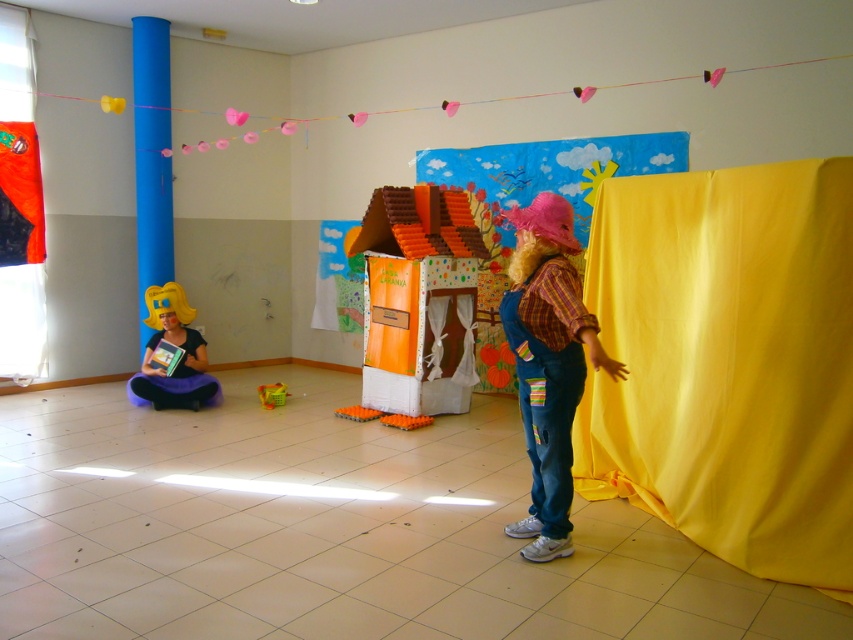
Is matte yellow wig at left wider than translucent plastic toy at center?

Yes, matte yellow wig at left is wider than translucent plastic toy at center.

Is point (195, 336) less distant than point (263, 404)?

No.

I want to click on matte yellow wig at left, so coord(178,358).

Which is more to the right, denim overalls at right or orange foam blocks at center?

denim overalls at right is more to the right.

Which is more to the left, denim overalls at right or orange foam blocks at center?

orange foam blocks at center

Between point (570, 300) and point (424, 420), which one is positioned behind?

The point (424, 420) is behind.

Find the location of a particular element. denim overalls at right is located at coordinates (548, 364).

Does yellow fabric at right have a greater height compared to orange fabric curtain at left?

Incorrect, yellow fabric at right's height is not larger of orange fabric curtain at left's.

Can you confirm if yellow fabric at right is positioned above orange fabric curtain at left?

Yes.

Which is behind, point (631, 6) or point (0, 148)?

The point (0, 148) is more distant.

You are a GUI agent. You are given a task and a screenshot of the screen. Output one action in this format:
    pyautogui.click(x=<x>, y=<y>)
    Task: Click on the yellow fabric at right
    This screenshot has width=853, height=640.
    Given the screenshot: What is the action you would take?
    pyautogui.click(x=469, y=129)